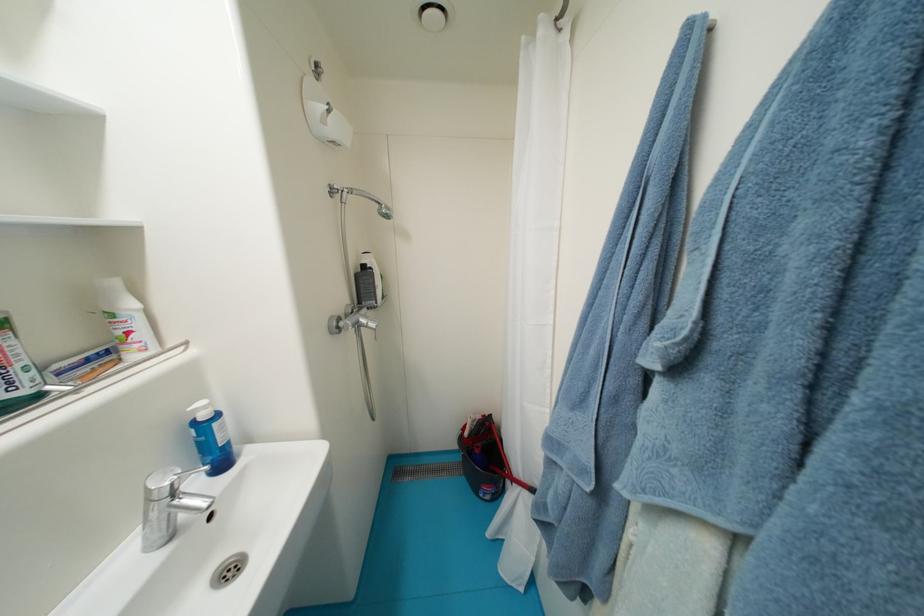
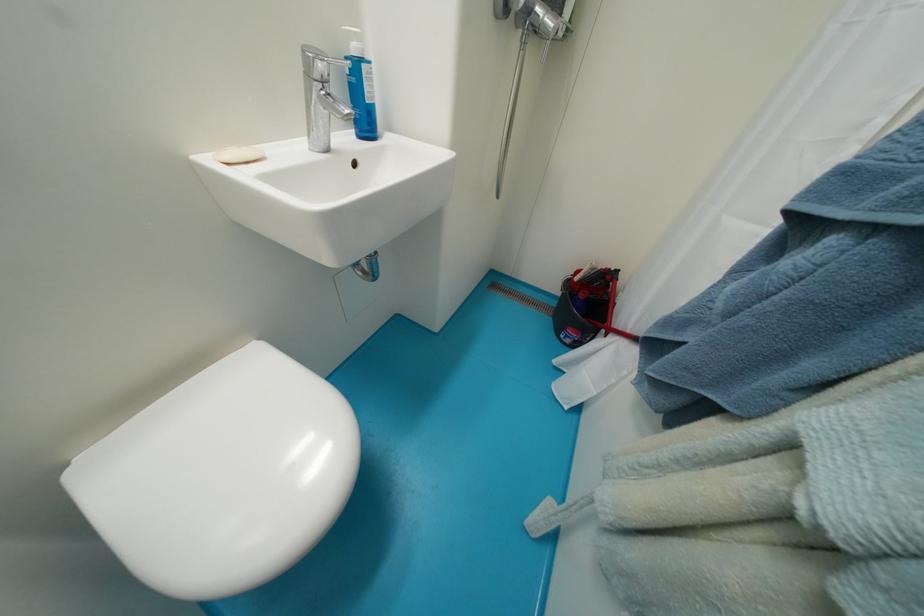
The point at (223, 427) is marked in the first image. Where is the corresponding point in the second image?

(371, 70)